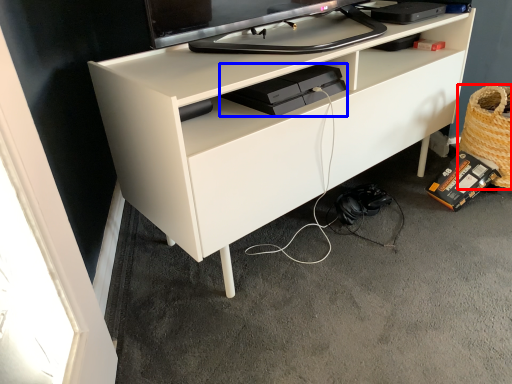
Question: Which object appears farthest to the camera in this image, basket (highlighted by a red box) or equipment (highlighted by a blue box)?

Choices:
 (A) basket
 (B) equipment

Answer: (A)